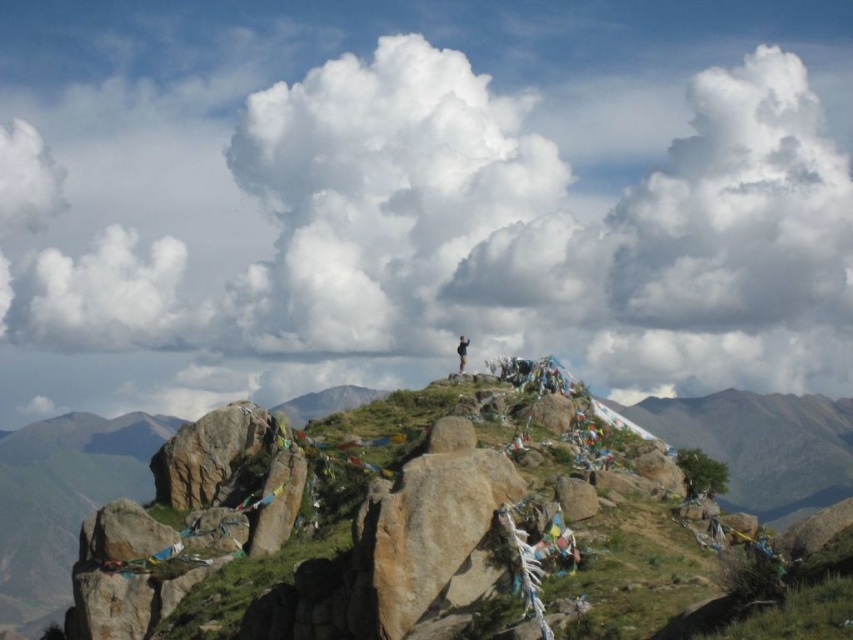
Question: Can you confirm if rusty rock at center is positioned below smooth brown rock at center?

Choices:
 (A) yes
 (B) no

Answer: (B)

Question: Is smooth brown rock at center smaller than black fabric person at center?

Choices:
 (A) yes
 (B) no

Answer: (A)

Question: Estimate the real-world distances between objects in this image. Which object is farther from the smooth brown rock at center?

Choices:
 (A) black fabric person at center
 (B) rusty rock at center

Answer: (A)

Question: Does smooth brown rock at center have a lesser width compared to black fabric person at center?

Choices:
 (A) no
 (B) yes

Answer: (B)

Question: Which point is farther to the camera?

Choices:
 (A) black fabric person at center
 (B) rusty rock at center

Answer: (A)

Question: Which object is the farthest from the smooth brown rock at center?

Choices:
 (A) black fabric person at center
 (B) rusty rock at center

Answer: (A)